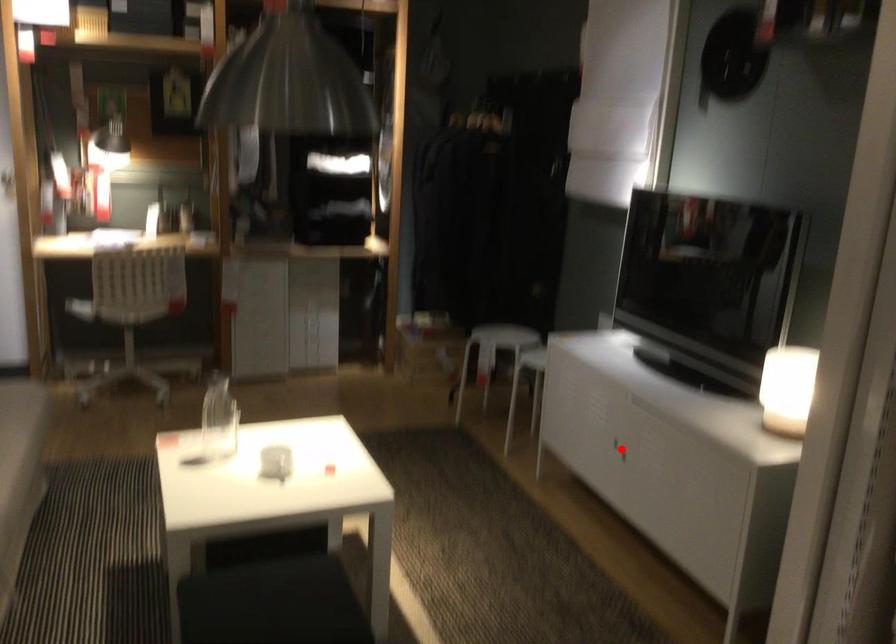
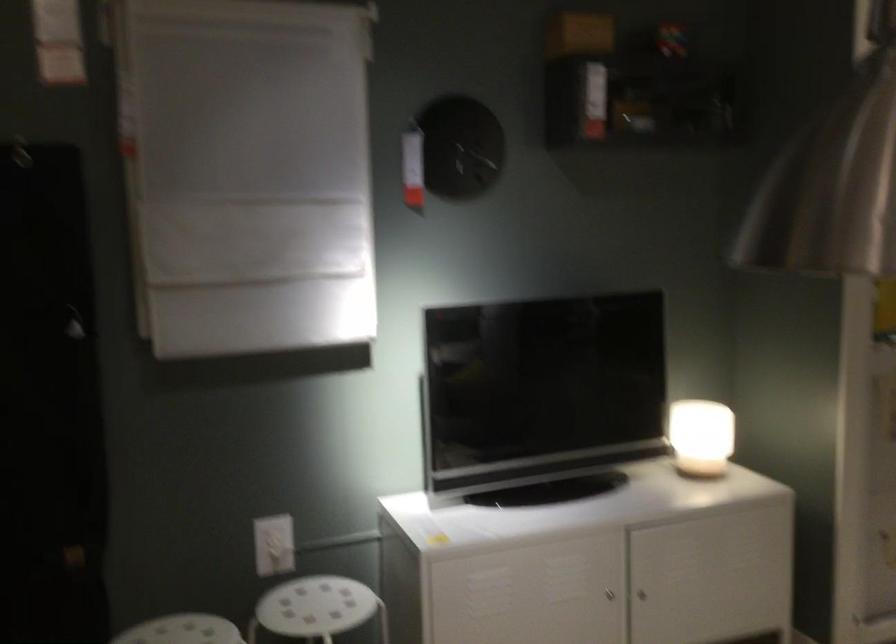
Question: I am providing you with two images of the same scene from different viewpoints. Image1 has a red point marked. In image2, the corresponding 3D location appears at what relative position? Reply with the corresponding letter.

Choices:
 (A) Closer
 (B) Farther

Answer: (A)